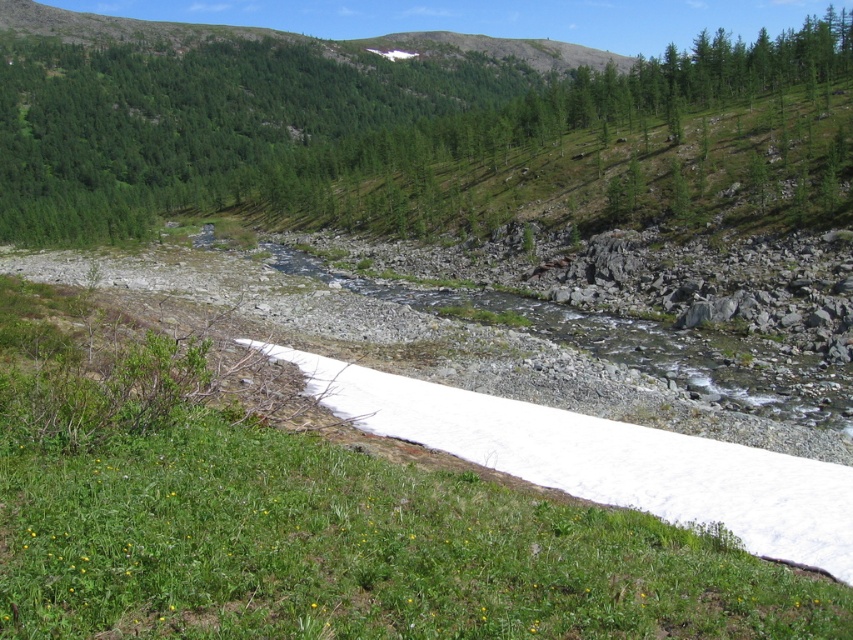
Question: Does green textured tree at upper center appear on the right side of white powder snow at lower left?

Choices:
 (A) no
 (B) yes

Answer: (A)

Question: Which point is farther to the camera?

Choices:
 (A) green textured tree at upper center
 (B) white powder snow at lower left

Answer: (A)

Question: Is green textured tree at upper center positioned behind white powder snow at lower left?

Choices:
 (A) yes
 (B) no

Answer: (A)

Question: Does green textured tree at upper center appear on the right side of white powder snow at lower left?

Choices:
 (A) no
 (B) yes

Answer: (A)

Question: Which of the following is the farthest from the observer?

Choices:
 (A) white powder snow at lower left
 (B) green textured tree at upper center

Answer: (B)